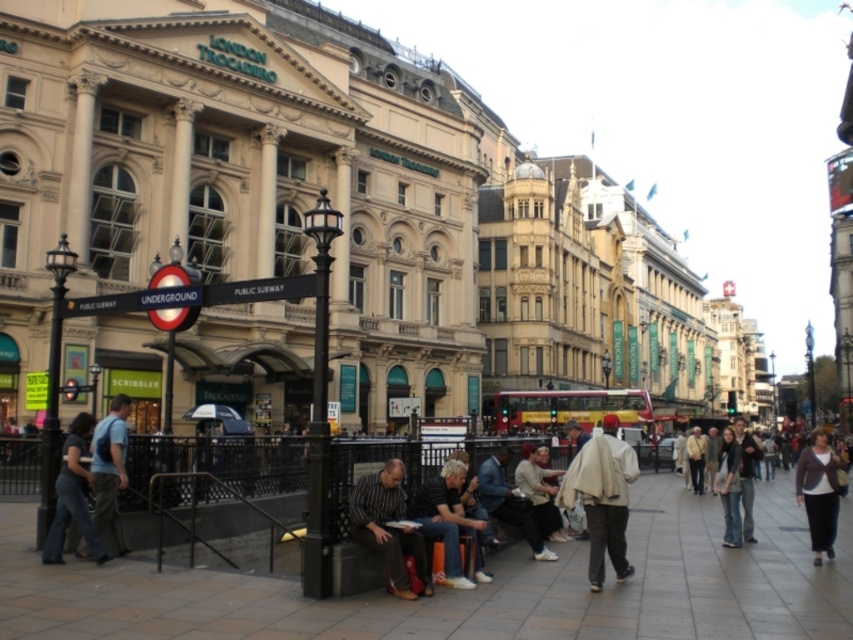
Question: Which of the following is the closest to the observer?

Choices:
 (A) paved stone sidewalk at center
 (B) striped fabric shirt at center
 (C) dark brown sweater at lower right
 (D) dark blue jeans at lower left

Answer: (A)

Question: Considering the relative positions of white woolen coat at center and dark gray fabric jacket at center in the image provided, where is white woolen coat at center located with respect to dark gray fabric jacket at center?

Choices:
 (A) above
 (B) below

Answer: (B)

Question: Can you confirm if white woolen coat at center is positioned to the left of dark gray fabric jacket at center?

Choices:
 (A) yes
 (B) no

Answer: (B)

Question: Does black metal sign at center have a smaller size compared to blue denim jeans at lower left?

Choices:
 (A) no
 (B) yes

Answer: (A)

Question: Estimate the real-world distances between objects in this image. Which object is farther from the paved stone sidewalk at center?

Choices:
 (A) dark blue jeans at lower left
 (B) dark gray fabric jacket at center
 (C) black metal sign at center
 (D) blue denim jeans at lower left

Answer: (C)

Question: Considering the real-world distances, which object is farthest from the dark brown sweater at lower right?

Choices:
 (A) dark gray fabric jacket at center
 (B) white woolen coat at center
 (C) blue denim jeans at lower left

Answer: (C)